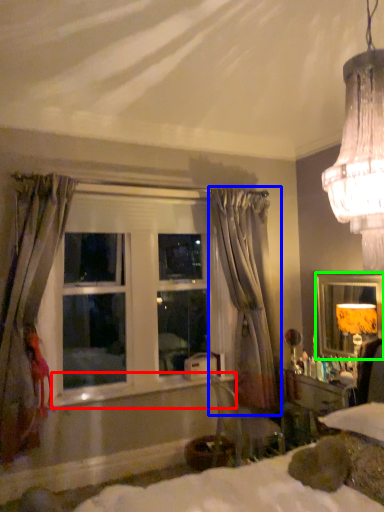
Question: Which object is the closest to the window sill (highlighted by a red box)? Choose among these: curtain (highlighted by a blue box) or mirror (highlighted by a green box).

Choices:
 (A) curtain
 (B) mirror

Answer: (A)